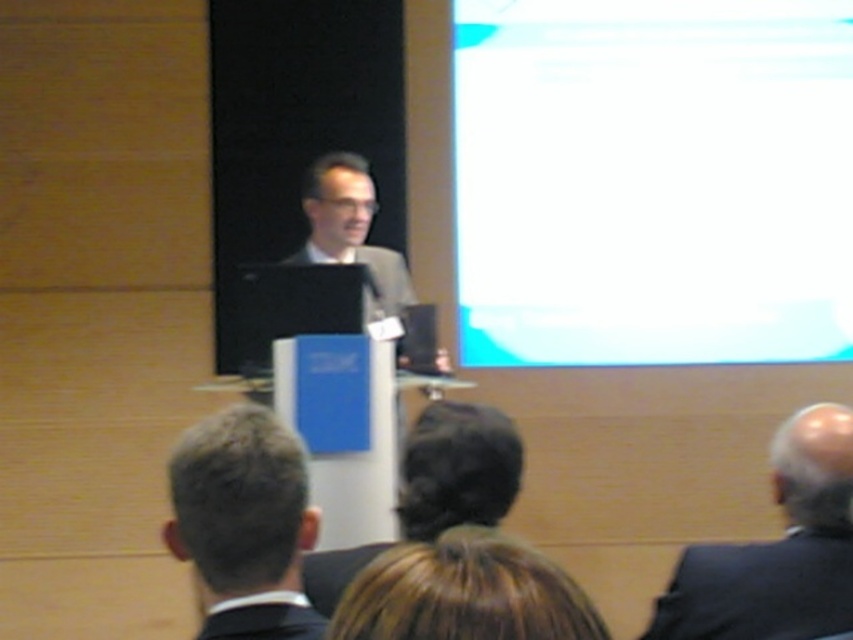
Question: Among these objects, which one is nearest to the camera?

Choices:
 (A) white glossy projection screen at upper right
 (B) matte gray suit at center

Answer: (B)

Question: Estimate the real-world distances between objects in this image. Which object is farther from the dark gray suit at center?

Choices:
 (A) brown hair at center
 (B) black matte suit at lower center

Answer: (A)

Question: Can you confirm if dark brown hair at center is smaller than black matte suit at lower center?

Choices:
 (A) no
 (B) yes

Answer: (A)

Question: Considering the relative positions of brown hair at center and dark brown hair at center in the image provided, where is brown hair at center located with respect to dark brown hair at center?

Choices:
 (A) below
 (B) above

Answer: (B)

Question: Which object is closer to the camera taking this photo?

Choices:
 (A) brown hair at center
 (B) black matte suit at lower right
 (C) matte gray suit at center
 (D) dark brown hair at center

Answer: (A)

Question: In this image, where is brown hair at center located relative to black matte suit at lower center?

Choices:
 (A) left
 (B) right

Answer: (B)